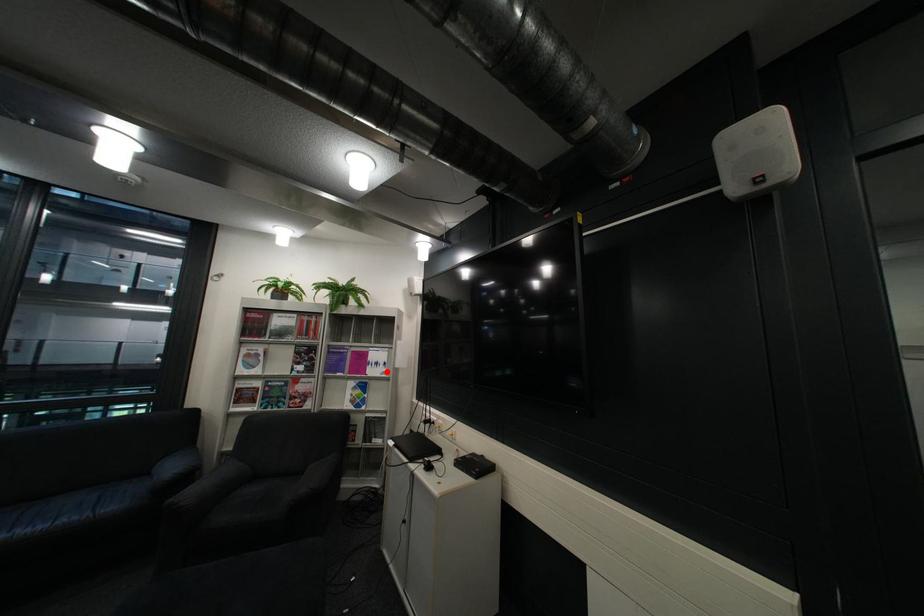
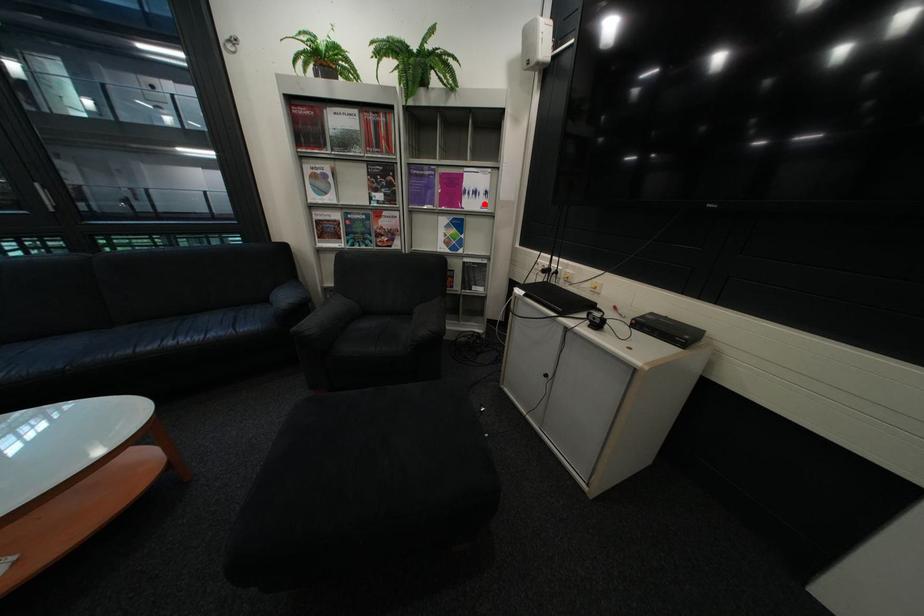
I am providing you with two images of the same scene from different viewpoints. A red point is marked on the first image and another point is marked on the second image. Is the marked point in image1 the same physical position as the marked point in image2?

Yes